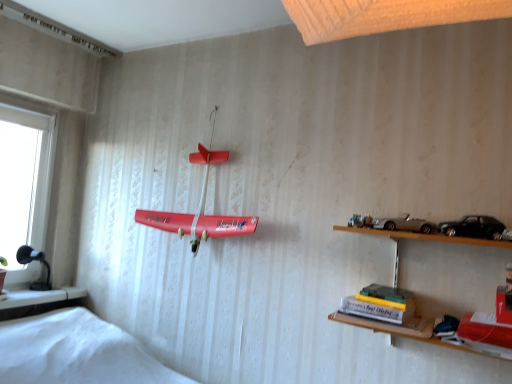
What do you see at coordinates (380, 304) in the screenshot? This screenshot has height=384, width=512. I see `hardcover book at lower right` at bounding box center [380, 304].

What is the approximate width of black plastic lamp at lower left?

black plastic lamp at lower left is 3.82 inches in width.

The width and height of the screenshot is (512, 384). What do you see at coordinates (200, 207) in the screenshot?
I see `matte red airplane at center` at bounding box center [200, 207].

Where is `black matte toy car at upper right, acting as the 1th toy car starting from the front`? The width and height of the screenshot is (512, 384). black matte toy car at upper right, acting as the 1th toy car starting from the front is located at coordinates (473, 227).

The image size is (512, 384). In order to click on hardcover book at lower right in this screenshot , I will do `click(380, 304)`.

Based on the photo, are black matte toy car at upper right, which appears as the second toy car when viewed from the left, and hardcover book at lower right making contact?

No, black matte toy car at upper right, which appears as the second toy car when viewed from the left, is not making contact with hardcover book at lower right.

Between black matte toy car at upper right, which appears as the 2th toy car when viewed from the back, and hardcover book at lower right, which one has larger width?

hardcover book at lower right.

Does point (486, 232) come closer to viewer compared to point (398, 292)?

That is True.

Based on their sizes in the image, would you say black matte toy car at upper right, which appears as the 2th toy car when viewed from the back, is bigger or smaller than hardcover book at lower right?

Clearly, black matte toy car at upper right, which appears as the 2th toy car when viewed from the back, is smaller in size than hardcover book at lower right.

Between hardcover book at lower right and silver metallic toy car at upper right, the 2th toy car from the front, which one has smaller width?

silver metallic toy car at upper right, the 2th toy car from the front, is thinner.

Consider the image. How much distance is there between hardcover book at lower right and silver metallic toy car at upper right, arranged as the second toy car when viewed from the right?

hardcover book at lower right is 11.31 inches from silver metallic toy car at upper right, arranged as the second toy car when viewed from the right.

Is point (405, 307) farther from viewer compared to point (433, 229)?

Yes, it is.

Is hardcover book at lower right not within silver metallic toy car at upper right, arranged as the second toy car when viewed from the right?

hardcover book at lower right is positioned outside silver metallic toy car at upper right, arranged as the second toy car when viewed from the right.

Can we say hardcover book at lower right lies outside black plastic lamp at lower left?

hardcover book at lower right is positioned outside black plastic lamp at lower left.

Is hardcover book at lower right far from black plastic lamp at lower left?

Indeed, hardcover book at lower right is not near black plastic lamp at lower left.

Can you confirm if hardcover book at lower right is shorter than black plastic lamp at lower left?

Indeed, hardcover book at lower right has a lesser height compared to black plastic lamp at lower left.

This screenshot has height=384, width=512. I want to click on lamp located below the hardcover book at lower right (from the image's perspective), so click(31, 261).

Is black plastic lamp at lower left located outside silver metallic toy car at upper right, which is the 1th toy car from left to right?

Yes, black plastic lamp at lower left is outside of silver metallic toy car at upper right, which is the 1th toy car from left to right.

From a real-world perspective, is black plastic lamp at lower left positioned over silver metallic toy car at upper right, the 2th toy car from the front, based on gravity?

Incorrect, from a real-world perspective, black plastic lamp at lower left is lower than silver metallic toy car at upper right, the 2th toy car from the front.

What are the coordinates of `lamp behind the silver metallic toy car at upper right, placed as the 1th toy car when sorted from back to front` in the screenshot? It's located at (31, 261).

Is black plastic lamp at lower left turned away from silver metallic toy car at upper right, the 2th toy car from the front?

black plastic lamp at lower left is not turned away from silver metallic toy car at upper right, the 2th toy car from the front.

Is matte red airplane at center positioned beyond the bounds of silver metallic toy car at upper right, arranged as the second toy car when viewed from the right?

matte red airplane at center is positioned outside silver metallic toy car at upper right, arranged as the second toy car when viewed from the right.

Is matte red airplane at center further to the viewer compared to silver metallic toy car at upper right, which is the 1th toy car from left to right?

Yes, matte red airplane at center is further from the viewer.

Considering the positions of objects matte red airplane at center and silver metallic toy car at upper right, placed as the 1th toy car when sorted from back to front, in the image provided, who is more to the right, matte red airplane at center or silver metallic toy car at upper right, placed as the 1th toy car when sorted from back to front,?

silver metallic toy car at upper right, placed as the 1th toy car when sorted from back to front, is more to the right.

Is matte red airplane at center oriented towards silver metallic toy car at upper right, the 2th toy car from the front?

No, matte red airplane at center is not turned towards silver metallic toy car at upper right, the 2th toy car from the front.

Considering the sizes of silver metallic toy car at upper right, the 2th toy car from the front, and hardcover book at lower right in the image, is silver metallic toy car at upper right, the 2th toy car from the front, bigger or smaller than hardcover book at lower right?

In the image, silver metallic toy car at upper right, the 2th toy car from the front, appears to be smaller than hardcover book at lower right.

How much distance is there between silver metallic toy car at upper right, the 2th toy car from the front, and hardcover book at lower right?

The distance of silver metallic toy car at upper right, the 2th toy car from the front, from hardcover book at lower right is 11.31 inches.

From a real-world perspective, who is located lower, silver metallic toy car at upper right, placed as the 1th toy car when sorted from back to front, or hardcover book at lower right?

hardcover book at lower right is physically lower.

From a real-world perspective, starting from the hardcover book at lower right, which toy car is the 1st one vertically above it? Please provide its 2D coordinates.

[(404, 224)]

How different are the orientations of black plastic lamp at lower left and hardcover book at lower right in degrees?

87.6 degrees separate the facing orientations of black plastic lamp at lower left and hardcover book at lower right.

How much distance is there between black plastic lamp at lower left and hardcover book at lower right?

The distance of black plastic lamp at lower left from hardcover book at lower right is 6.64 feet.

Considering the points (19, 259) and (349, 296), which point is behind, point (19, 259) or point (349, 296)?

Point (19, 259)

Considering the sizes of objects black plastic lamp at lower left and hardcover book at lower right in the image provided, who is shorter, black plastic lamp at lower left or hardcover book at lower right?

With less height is hardcover book at lower right.

You are a GUI agent. You are given a task and a screenshot of the screen. Output one action in this format:
    pyautogui.click(x=<x>, y=<y>)
    Task: Click on the 1st toy car positioned above the hardcover book at lower right (from the image's perspective)
    The width and height of the screenshot is (512, 384).
    Given the screenshot: What is the action you would take?
    pyautogui.click(x=473, y=227)

The width and height of the screenshot is (512, 384). I want to click on the 2nd toy car behind the hardcover book at lower right, so click(404, 224).

Which object lies nearer to the anchor point hardcover book at lower right, black matte toy car at upper right, the 1th toy car when ordered from right to left, or silver metallic toy car at upper right, arranged as the second toy car when viewed from the right?

silver metallic toy car at upper right, arranged as the second toy car when viewed from the right, is positioned closer to the anchor hardcover book at lower right.

Which object lies nearer to the anchor point black matte toy car at upper right, which appears as the 2th toy car when viewed from the back, silver metallic toy car at upper right, arranged as the second toy car when viewed from the right, or black plastic lamp at lower left?

Based on the image, silver metallic toy car at upper right, arranged as the second toy car when viewed from the right, appears to be nearer to black matte toy car at upper right, which appears as the 2th toy car when viewed from the back.

Which object lies nearer to the anchor point matte red airplane at center, hardcover book at lower right or silver metallic toy car at upper right, arranged as the second toy car when viewed from the right?

hardcover book at lower right is positioned closer to the anchor matte red airplane at center.

From the image, which object appears to be farther from black matte toy car at upper right, acting as the 1th toy car starting from the front, hardcover book at lower right or black plastic lamp at lower left?

black plastic lamp at lower left is further to black matte toy car at upper right, acting as the 1th toy car starting from the front.

From the picture: From the image, which object appears to be farther from black plastic lamp at lower left, hardcover book at lower right or matte red airplane at center?

Among the two, hardcover book at lower right is located further to black plastic lamp at lower left.

When comparing their distances from black matte toy car at upper right, acting as the 1th toy car starting from the front, does black plastic lamp at lower left or matte red airplane at center seem further?

black plastic lamp at lower left is positioned further to the anchor black matte toy car at upper right, acting as the 1th toy car starting from the front.

Estimate the real-world distances between objects in this image. Which object is further from hardcover book at lower right, matte red airplane at center or black matte toy car at upper right, which appears as the second toy car when viewed from the left?

matte red airplane at center is positioned further to the anchor hardcover book at lower right.

Considering their positions, is black matte toy car at upper right, which appears as the 2th toy car when viewed from the back, positioned closer to silver metallic toy car at upper right, which is the 1th toy car from left to right, than hardcover book at lower right?

Based on the image, black matte toy car at upper right, which appears as the 2th toy car when viewed from the back, appears to be nearer to silver metallic toy car at upper right, which is the 1th toy car from left to right.

At what (x,y) coordinates should I click in order to perform the action: click on toy car between silver metallic toy car at upper right, the 2th toy car from the front, and hardcover book at lower right vertically. Please return your answer as a coordinate pair (x, y). Looking at the image, I should click on (473, 227).

What are the coordinates of `toy situated between black plastic lamp at lower left and hardcover book at lower right from left to right` in the screenshot? It's located at (200, 207).

This screenshot has width=512, height=384. Find the location of `book between black plastic lamp at lower left and silver metallic toy car at upper right, the 2th toy car from the front, in the horizontal direction`. book between black plastic lamp at lower left and silver metallic toy car at upper right, the 2th toy car from the front, in the horizontal direction is located at coordinates (380, 304).

Where is `book between matte red airplane at center and black matte toy car at upper right, which appears as the second toy car when viewed from the left, from left to right`? The width and height of the screenshot is (512, 384). book between matte red airplane at center and black matte toy car at upper right, which appears as the second toy car when viewed from the left, from left to right is located at coordinates (380, 304).